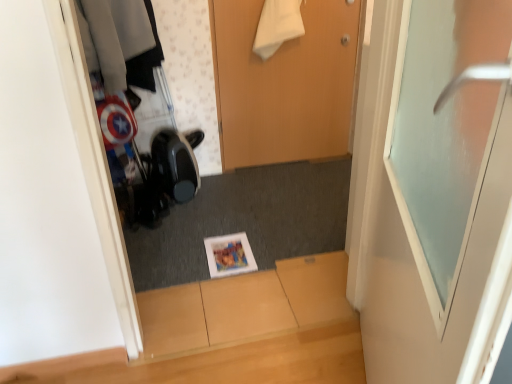
The width and height of the screenshot is (512, 384). What are the coordinates of `vacant space situated on the left part of matte paper magazine at center` in the screenshot? It's located at pos(179,255).